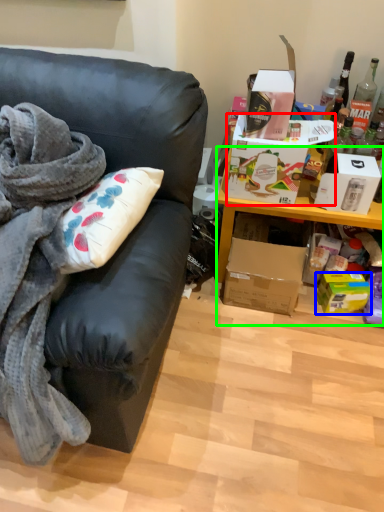
Question: Based on their relative distances, which object is farther from box (highlighted by a red box)? Choose from box (highlighted by a blue box) and cabinetry (highlighted by a green box).

Choices:
 (A) box
 (B) cabinetry

Answer: (A)